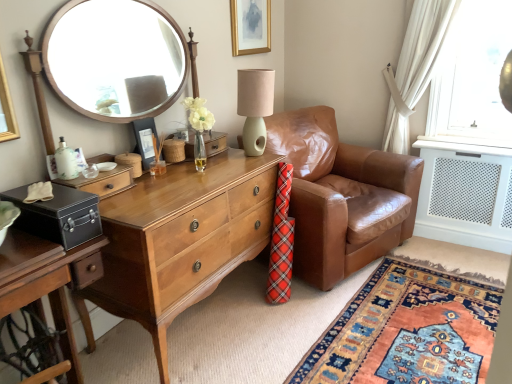
Identify the location of free spot to the right of black matte picture frame at center, the second picture frame positioned from the back. Image resolution: width=512 pixels, height=384 pixels. (173, 165).